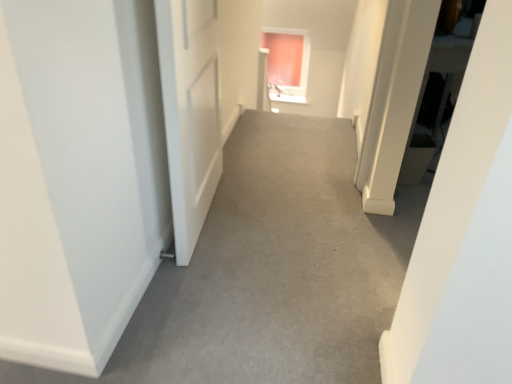
Question: Looking at their shapes, would you say pink glass window at upper center is wider or thinner than gray carpet at center?

Choices:
 (A) thin
 (B) wide

Answer: (A)

Question: Which is correct: pink glass window at upper center is inside gray carpet at center, or outside of it?

Choices:
 (A) outside
 (B) inside

Answer: (A)

Question: In terms of height, does pink glass window at upper center look taller or shorter compared to gray carpet at center?

Choices:
 (A) short
 (B) tall

Answer: (B)

Question: Choose the correct answer: Is gray carpet at center inside pink glass window at upper center or outside it?

Choices:
 (A) inside
 (B) outside

Answer: (B)

Question: Looking at their shapes, would you say gray carpet at center is wider or thinner than pink glass window at upper center?

Choices:
 (A) wide
 (B) thin

Answer: (A)

Question: Considering the positions of gray carpet at center and pink glass window at upper center in the image, is gray carpet at center taller or shorter than pink glass window at upper center?

Choices:
 (A) tall
 (B) short

Answer: (B)

Question: Is gray carpet at center to the left or to the right of pink glass window at upper center in the image?

Choices:
 (A) right
 (B) left

Answer: (B)